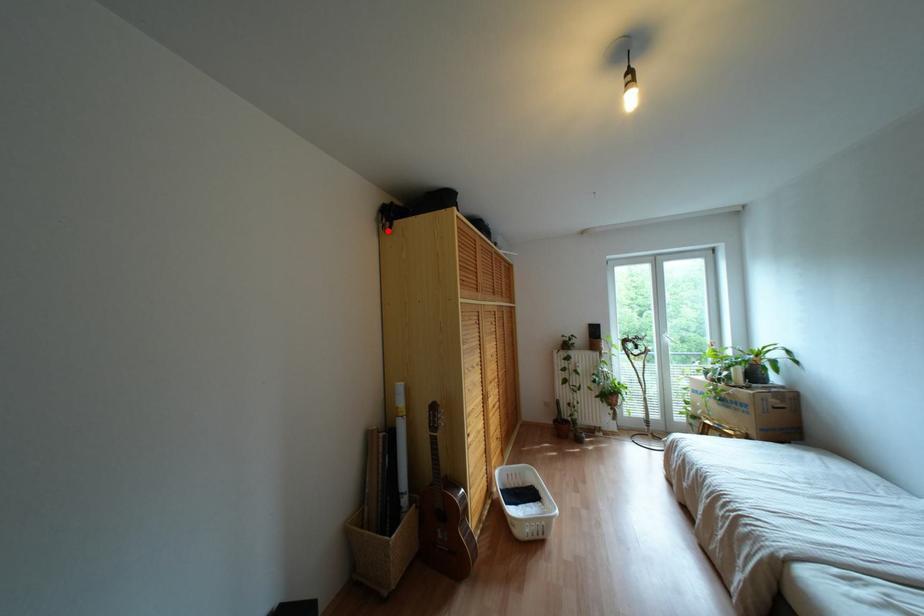
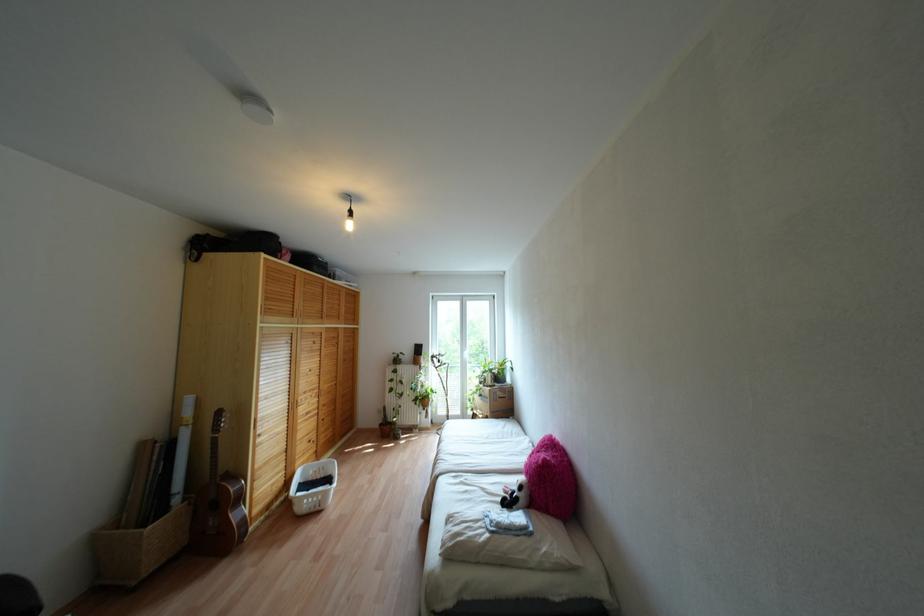
Find the pixel in the second image that matches the highlighted location in the first image.

(196, 260)